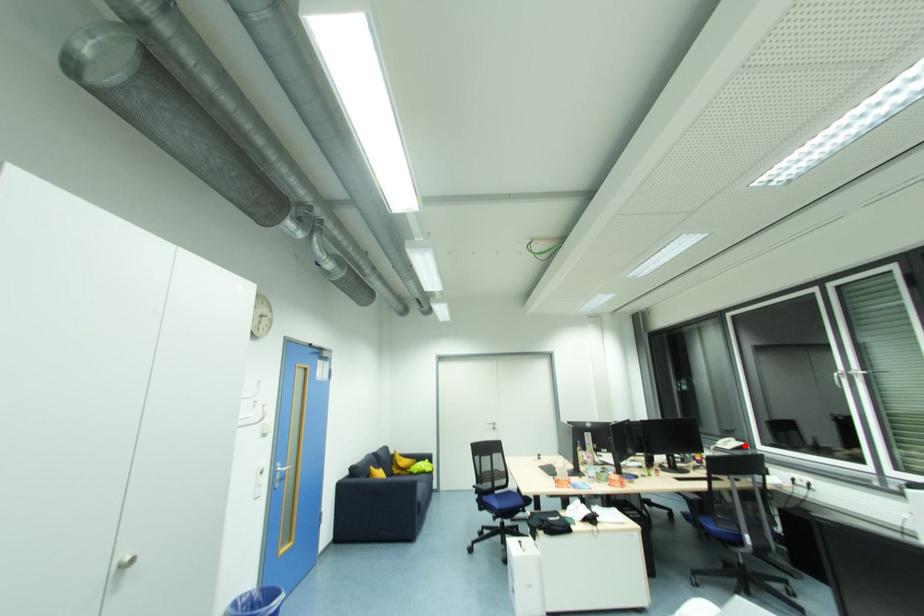
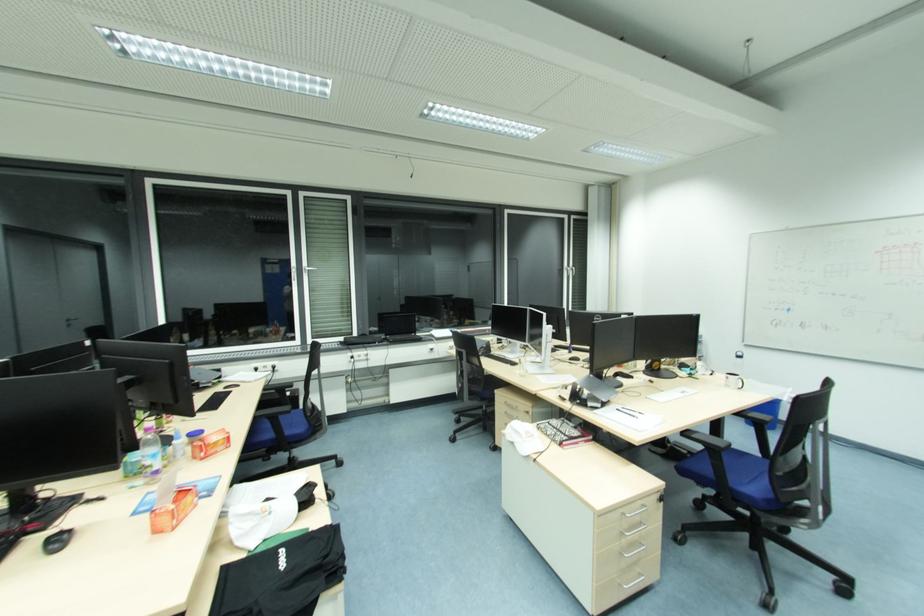
Question: I am providing you with two images of the same scene from different viewpoints. A red point is marked on the first image. Is the red point's position out of view in image 2?

Choices:
 (A) Yes
 (B) No

Answer: (A)